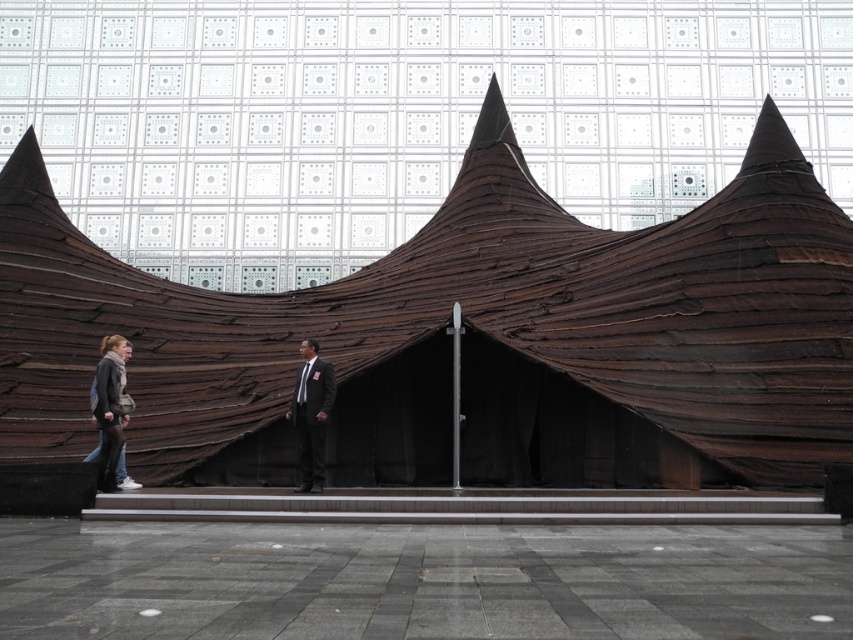
You are a photographer setting up for a photoshoot. You have two outfits to feature in the image. The first is the matte black suit at center, and the second is the matte gray jacket at lower left. Based on their sizes, which outfit would you recommend placing closer to the camera to ensure it stands out more in the composition?

The matte gray jacket at lower left is larger in size compared to the matte black suit at center. To make it stand out more, place the matte gray jacket at lower left closer to the camera.

You are standing at the center of the paved area in front of the architectural structure. You notice two points marked on the ground at coordinates point (699, 408) and point (115, 445). Which point is closer to the structure?

Point (699, 408) is behind point (115, 445), so the point closer to the structure is point (699, 408).